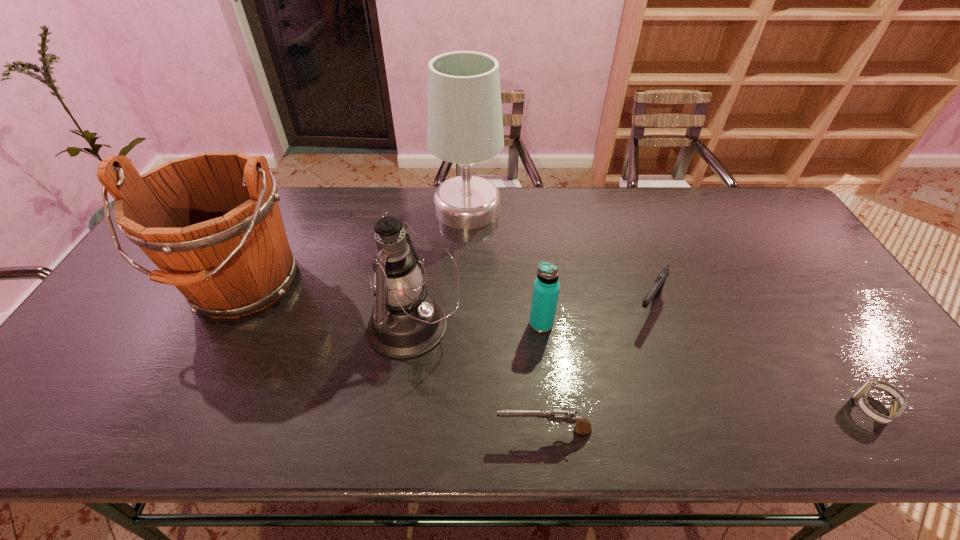
Locate an element on the screen. The width and height of the screenshot is (960, 540). watch is located at coordinates (897, 406).

Locate an element on the screen. This screenshot has height=540, width=960. vacant space situated 0.290m on the base of the tallest object is located at coordinates (588, 208).

Identify the location of free space located with the handle on the side of the bucket. (166, 436).

Where is `free location located 0.090m on the right of the oil lamp`? The height and width of the screenshot is (540, 960). free location located 0.090m on the right of the oil lamp is located at coordinates (495, 327).

Locate an element on the screen. blank area located on the front of the fourth shortest object is located at coordinates (551, 410).

Locate an element on the screen. The width and height of the screenshot is (960, 540). vacant position located at the muzzle of the farther gun is located at coordinates (674, 383).

Where is `vacant space located 0.110m aiming along the barrel of the left gun`? The image size is (960, 540). vacant space located 0.110m aiming along the barrel of the left gun is located at coordinates (444, 430).

This screenshot has height=540, width=960. Find the location of `vacant space situated 0.160m aiming along the barrel of the left gun`. vacant space situated 0.160m aiming along the barrel of the left gun is located at coordinates (421, 430).

Identify the location of free region located aiming along the barrel of the left gun. The height and width of the screenshot is (540, 960). (361, 430).

Where is `free space located 0.120m on the face of the watch`? The image size is (960, 540). free space located 0.120m on the face of the watch is located at coordinates (798, 408).